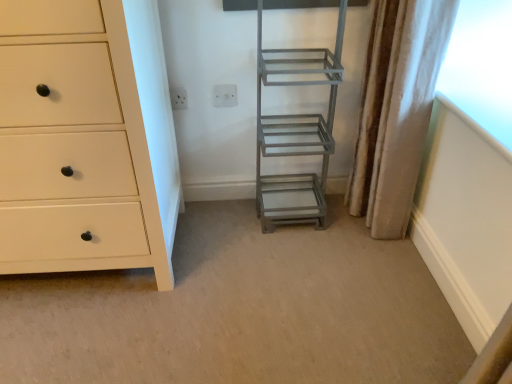
Question: Is the position of white plastic electric outlet at upper center, the 1th electric outlet positioned from the left, more distant than that of white plastic electric outlet at upper center, the 1th electric outlet positioned from the right?

Choices:
 (A) yes
 (B) no

Answer: (B)

Question: Does white plastic electric outlet at upper center, the 1th electric outlet positioned from the left, have a larger size compared to white plastic electric outlet at upper center, the 1th electric outlet positioned from the right?

Choices:
 (A) no
 (B) yes

Answer: (A)

Question: Is white plastic electric outlet at upper center, acting as the second electric outlet starting from the right, oriented away from white plastic electric outlet at upper center, the 2th electric outlet when ordered from left to right?

Choices:
 (A) no
 (B) yes

Answer: (A)

Question: Is white plastic electric outlet at upper center, acting as the second electric outlet starting from the right, to the left of white plastic electric outlet at upper center, the 2th electric outlet when ordered from left to right, from the viewer's perspective?

Choices:
 (A) yes
 (B) no

Answer: (A)

Question: Is white plastic electric outlet at upper center, the 1th electric outlet positioned from the left, thinner than white plastic electric outlet at upper center, the 2th electric outlet when ordered from left to right?

Choices:
 (A) yes
 (B) no

Answer: (B)

Question: Relative to silky beige curtain at right, is white matte chest of drawers at left in front or behind?

Choices:
 (A) front
 (B) behind

Answer: (A)

Question: Do you think white matte chest of drawers at left is within silky beige curtain at right, or outside of it?

Choices:
 (A) outside
 (B) inside

Answer: (A)

Question: In terms of height, does white matte chest of drawers at left look taller or shorter compared to silky beige curtain at right?

Choices:
 (A) tall
 (B) short

Answer: (A)

Question: In terms of width, does white matte chest of drawers at left look wider or thinner when compared to silky beige curtain at right?

Choices:
 (A) thin
 (B) wide

Answer: (B)

Question: Is white matte chest of drawers at left to the left or to the right of white plastic electric outlet at upper center, acting as the second electric outlet starting from the right, in the image?

Choices:
 (A) right
 (B) left

Answer: (B)

Question: Considering the positions of white matte chest of drawers at left and white plastic electric outlet at upper center, acting as the second electric outlet starting from the right, in the image, is white matte chest of drawers at left taller or shorter than white plastic electric outlet at upper center, acting as the second electric outlet starting from the right,?

Choices:
 (A) short
 (B) tall

Answer: (B)

Question: From a real-world perspective, is white matte chest of drawers at left positioned above or below white plastic electric outlet at upper center, the 1th electric outlet positioned from the left?

Choices:
 (A) below
 (B) above

Answer: (A)

Question: Relative to white plastic electric outlet at upper center, the 1th electric outlet positioned from the left, is white matte chest of drawers at left in front or behind?

Choices:
 (A) front
 (B) behind

Answer: (A)

Question: Would you say silky beige curtain at right is inside or outside metallic gray ladder at center?

Choices:
 (A) outside
 (B) inside

Answer: (A)

Question: From a real-world perspective, is silky beige curtain at right positioned above or below metallic gray ladder at center?

Choices:
 (A) above
 (B) below

Answer: (A)